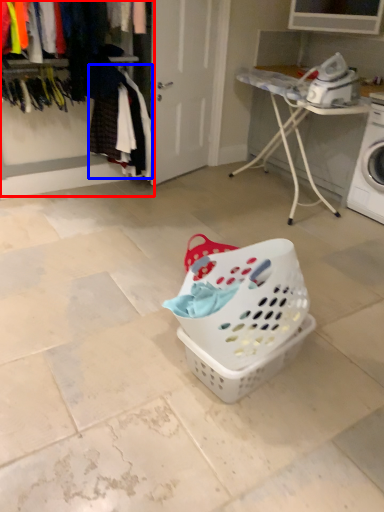
Question: Among these objects, which one is nearest to the camera, closet (highlighted by a red box) or clothing (highlighted by a blue box)?

Choices:
 (A) closet
 (B) clothing

Answer: (A)